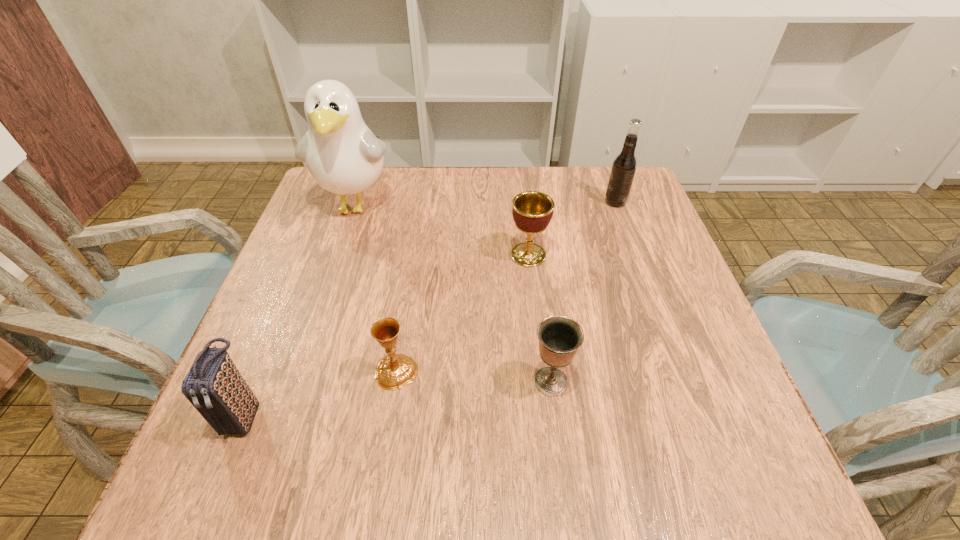
Locate an element on the screen. object located in the far right corner section of the desktop is located at coordinates (624, 166).

This screenshot has height=540, width=960. In the image, there is a desktop. Find the location of `vacant area at the far edge`. vacant area at the far edge is located at coordinates (541, 176).

The image size is (960, 540). I want to click on free space at the left edge of the desktop, so click(x=323, y=347).

Find the location of a particular element. This screenshot has width=960, height=540. free space at the right edge of the desktop is located at coordinates (660, 394).

You are a GUI agent. You are given a task and a screenshot of the screen. Output one action in this format:
    pyautogui.click(x=<x>, y=<y>)
    Task: Click on the vacant space at the far left corner of the desktop
    The width and height of the screenshot is (960, 540).
    Given the screenshot: What is the action you would take?
    pyautogui.click(x=318, y=194)

Find the location of a particular element. vacant area at the near left corner is located at coordinates (195, 470).

Where is `free space at the far right corner of the desktop`? free space at the far right corner of the desktop is located at coordinates (576, 169).

Find the location of a particular element. This screenshot has width=960, height=540. vacant space that's between the clutch bag and the tallest object is located at coordinates (300, 310).

Locate an element on the screen. empty space that is in between the fourth nearest object and the rightmost object is located at coordinates click(572, 228).

Find the location of `empty space that is in between the gull and the clutch bag`. empty space that is in between the gull and the clutch bag is located at coordinates (300, 310).